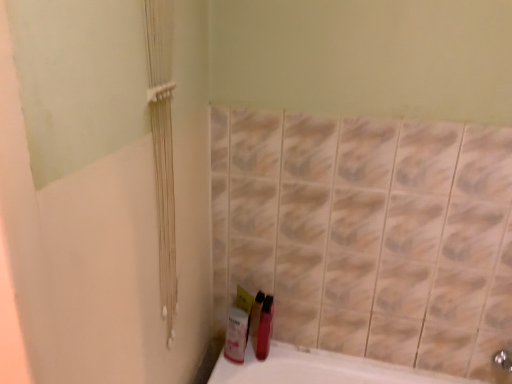
Question: Should I look upward or downward to see white glossy mouthwash at lower center, the second mouthwash positioned from the right?

Choices:
 (A) down
 (B) up

Answer: (A)

Question: In which direction should I rotate to look at shiny red plastic mouthwash at lower center, the 1th mouthwash when ordered from right to left?

Choices:
 (A) left
 (B) right

Answer: (B)

Question: Is white glossy mouthwash at lower center, acting as the 1th mouthwash starting from the left, closer to the viewer compared to shiny red plastic mouthwash at lower center, the 1th mouthwash when ordered from right to left?

Choices:
 (A) no
 (B) yes

Answer: (B)

Question: From the image's perspective, is white glossy mouthwash at lower center, the second mouthwash positioned from the right, under shiny red plastic mouthwash at lower center, acting as the 2th mouthwash starting from the left?

Choices:
 (A) no
 (B) yes

Answer: (B)

Question: Could you tell me if white glossy mouthwash at lower center, acting as the 1th mouthwash starting from the left, is turned towards shiny red plastic mouthwash at lower center, the 1th mouthwash when ordered from right to left?

Choices:
 (A) yes
 (B) no

Answer: (B)

Question: From a real-world perspective, is white glossy mouthwash at lower center, the second mouthwash positioned from the right, on top of shiny red plastic mouthwash at lower center, acting as the 2th mouthwash starting from the left?

Choices:
 (A) yes
 (B) no

Answer: (B)

Question: Is white glossy mouthwash at lower center, acting as the 1th mouthwash starting from the left, not close to shiny red plastic mouthwash at lower center, the 1th mouthwash when ordered from right to left?

Choices:
 (A) yes
 (B) no

Answer: (B)

Question: Is white glossy mouthwash at lower center, acting as the 1th mouthwash starting from the left, taller than shiny red plastic mouthwash at lower center, the 1th mouthwash when ordered from right to left?

Choices:
 (A) no
 (B) yes

Answer: (A)

Question: Can you confirm if shiny red plastic mouthwash at lower center, the 1th mouthwash when ordered from right to left, is wider than white glossy mouthwash at lower center, the second mouthwash positioned from the right?

Choices:
 (A) no
 (B) yes

Answer: (B)

Question: Considering the relative sizes of shiny red plastic mouthwash at lower center, the 1th mouthwash when ordered from right to left, and white glossy mouthwash at lower center, acting as the 1th mouthwash starting from the left, in the image provided, is shiny red plastic mouthwash at lower center, the 1th mouthwash when ordered from right to left, shorter than white glossy mouthwash at lower center, acting as the 1th mouthwash starting from the left,?

Choices:
 (A) no
 (B) yes

Answer: (A)

Question: Can you confirm if shiny red plastic mouthwash at lower center, the 1th mouthwash when ordered from right to left, is positioned to the right of white glossy mouthwash at lower center, acting as the 1th mouthwash starting from the left?

Choices:
 (A) no
 (B) yes

Answer: (B)

Question: Is shiny red plastic mouthwash at lower center, the 1th mouthwash when ordered from right to left, thinner than white glossy mouthwash at lower center, the second mouthwash positioned from the right?

Choices:
 (A) yes
 (B) no

Answer: (B)

Question: Is shiny red plastic mouthwash at lower center, the 1th mouthwash when ordered from right to left, looking in the opposite direction of white glossy mouthwash at lower center, the second mouthwash positioned from the right?

Choices:
 (A) yes
 (B) no

Answer: (A)

Question: Is shiny red plastic mouthwash at lower center, the 1th mouthwash when ordered from right to left, behind white glossy mouthwash at lower center, the second mouthwash positioned from the right?

Choices:
 (A) no
 (B) yes

Answer: (B)

Question: From the image's perspective, is white glossy mouthwash at lower center, acting as the 1th mouthwash starting from the left, above or below shiny red plastic mouthwash at lower center, acting as the 2th mouthwash starting from the left?

Choices:
 (A) above
 (B) below

Answer: (B)